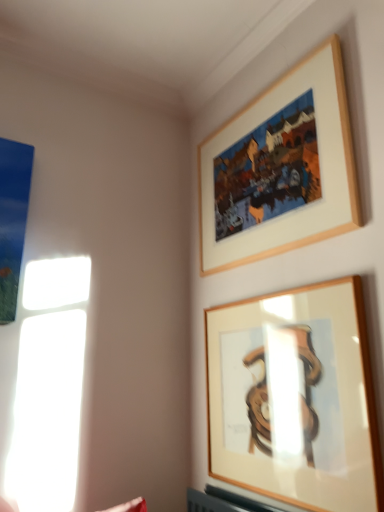
I want to click on wooden frame at upper center, the first picture frame in the top-to-bottom sequence, so click(x=281, y=168).

Describe the element at coordinates (281, 168) in the screenshot. I see `wooden frame at upper center, the first picture frame in the top-to-bottom sequence` at that location.

Measure the distance between wooden frame at upper center, the first picture frame in the top-to-bottom sequence, and camera.

A distance of 1.32 meters exists between wooden frame at upper center, the first picture frame in the top-to-bottom sequence, and camera.

The image size is (384, 512). What do you see at coordinates (295, 398) in the screenshot?
I see `wooden frame at upper center, marked as the 1th picture frame in a bottom-to-top arrangement` at bounding box center [295, 398].

At what (x,y) coordinates should I click in order to perform the action: click on wooden frame at upper center, marked as the 1th picture frame in a bottom-to-top arrangement. Please return your answer as a coordinate pair (x, y). This screenshot has height=512, width=384. Looking at the image, I should click on (295, 398).

Find the location of a particular element. This screenshot has height=512, width=384. wooden frame at upper center, the first picture frame in the top-to-bottom sequence is located at coordinates (281, 168).

Does wooden frame at upper center, positioned as the second picture frame in top-to-bottom order, appear on the right side of wooden frame at upper center, which ranks as the second picture frame in bottom-to-top order?

Yes.

Does wooden frame at upper center, positioned as the second picture frame in top-to-bottom order, come behind wooden frame at upper center, the first picture frame in the top-to-bottom sequence?

No, it is in front of wooden frame at upper center, the first picture frame in the top-to-bottom sequence.

Which point is more forward, (282, 330) or (292, 208)?

The point (282, 330) is more forward.

Based on the photo, from the image's perspective, between wooden frame at upper center, positioned as the second picture frame in top-to-bottom order, and wooden frame at upper center, the first picture frame in the top-to-bottom sequence, which one is located above?

wooden frame at upper center, the first picture frame in the top-to-bottom sequence, is shown above in the image.

From a real-world perspective, is wooden frame at upper center, positioned as the second picture frame in top-to-bottom order, below wooden frame at upper center, which ranks as the second picture frame in bottom-to-top order?

Indeed, from a real-world perspective, wooden frame at upper center, positioned as the second picture frame in top-to-bottom order, is positioned beneath wooden frame at upper center, which ranks as the second picture frame in bottom-to-top order.

Is wooden frame at upper center, positioned as the second picture frame in top-to-bottom order, wider or thinner than wooden frame at upper center, the first picture frame in the top-to-bottom sequence?

Considering their sizes, wooden frame at upper center, positioned as the second picture frame in top-to-bottom order, looks slimmer than wooden frame at upper center, the first picture frame in the top-to-bottom sequence.

In terms of height, does wooden frame at upper center, positioned as the second picture frame in top-to-bottom order, look taller or shorter compared to wooden frame at upper center, which ranks as the second picture frame in bottom-to-top order?

wooden frame at upper center, positioned as the second picture frame in top-to-bottom order, is shorter than wooden frame at upper center, which ranks as the second picture frame in bottom-to-top order.

Who is smaller, wooden frame at upper center, positioned as the second picture frame in top-to-bottom order, or wooden frame at upper center, the first picture frame in the top-to-bottom sequence?

wooden frame at upper center, positioned as the second picture frame in top-to-bottom order, is smaller.

Would you say wooden frame at upper center, positioned as the second picture frame in top-to-bottom order, is inside or outside wooden frame at upper center, the first picture frame in the top-to-bottom sequence?

wooden frame at upper center, positioned as the second picture frame in top-to-bottom order, is not inside wooden frame at upper center, the first picture frame in the top-to-bottom sequence, it's outside.

Is wooden frame at upper center, marked as the 1th picture frame in a bottom-to-top arrangement, in contact with wooden frame at upper center, the first picture frame in the top-to-bottom sequence?

wooden frame at upper center, marked as the 1th picture frame in a bottom-to-top arrangement, and wooden frame at upper center, the first picture frame in the top-to-bottom sequence, are clearly separated.

Is wooden frame at upper center, positioned as the second picture frame in top-to-bottom order, oriented towards wooden frame at upper center, which ranks as the second picture frame in bottom-to-top order?

No, wooden frame at upper center, positioned as the second picture frame in top-to-bottom order, is not facing towards wooden frame at upper center, which ranks as the second picture frame in bottom-to-top order.

How different are the orientations of wooden frame at upper center, marked as the 1th picture frame in a bottom-to-top arrangement, and wooden frame at upper center, which ranks as the second picture frame in bottom-to-top order, in degrees?

The angular difference between wooden frame at upper center, marked as the 1th picture frame in a bottom-to-top arrangement, and wooden frame at upper center, which ranks as the second picture frame in bottom-to-top order, is 0.000767 degrees.

Locate an element on the screen. picture frame below the wooden frame at upper center, the first picture frame in the top-to-bottom sequence (from a real-world perspective) is located at coordinates click(295, 398).

Does wooden frame at upper center, the first picture frame in the top-to-bottom sequence, appear on the left side of wooden frame at upper center, marked as the 1th picture frame in a bottom-to-top arrangement?

Yes.

In the scene shown: Who is more distant, wooden frame at upper center, which ranks as the second picture frame in bottom-to-top order, or wooden frame at upper center, positioned as the second picture frame in top-to-bottom order?

Positioned behind is wooden frame at upper center, which ranks as the second picture frame in bottom-to-top order.

Considering the positions of point (313, 179) and point (335, 351), is point (313, 179) closer or farther from the camera than point (335, 351)?

Clearly, point (313, 179) is more distant from the camera than point (335, 351).

In the scene shown: From the image's perspective, is wooden frame at upper center, the first picture frame in the top-to-bottom sequence, located beneath wooden frame at upper center, positioned as the second picture frame in top-to-bottom order?

Incorrect, from the image's perspective, wooden frame at upper center, the first picture frame in the top-to-bottom sequence, is higher than wooden frame at upper center, positioned as the second picture frame in top-to-bottom order.

From a real-world perspective, is wooden frame at upper center, which ranks as the second picture frame in bottom-to-top order, physically located above or below wooden frame at upper center, marked as the 1th picture frame in a bottom-to-top arrangement?

Clearly, from a real-world perspective, wooden frame at upper center, which ranks as the second picture frame in bottom-to-top order, is above wooden frame at upper center, marked as the 1th picture frame in a bottom-to-top arrangement.

Is wooden frame at upper center, which ranks as the second picture frame in bottom-to-top order, wider or thinner than wooden frame at upper center, positioned as the second picture frame in top-to-bottom order?

Considering their sizes, wooden frame at upper center, which ranks as the second picture frame in bottom-to-top order, looks broader than wooden frame at upper center, positioned as the second picture frame in top-to-bottom order.

Can you confirm if wooden frame at upper center, the first picture frame in the top-to-bottom sequence, is taller than wooden frame at upper center, marked as the 1th picture frame in a bottom-to-top arrangement?

Correct, wooden frame at upper center, the first picture frame in the top-to-bottom sequence, is much taller as wooden frame at upper center, marked as the 1th picture frame in a bottom-to-top arrangement.

Between wooden frame at upper center, which ranks as the second picture frame in bottom-to-top order, and wooden frame at upper center, positioned as the second picture frame in top-to-bottom order, which one has larger size?

wooden frame at upper center, which ranks as the second picture frame in bottom-to-top order, is bigger.

Is wooden frame at upper center, which ranks as the second picture frame in bottom-to-top order, situated inside wooden frame at upper center, positioned as the second picture frame in top-to-bottom order, or outside?

wooden frame at upper center, which ranks as the second picture frame in bottom-to-top order, exists outside the volume of wooden frame at upper center, positioned as the second picture frame in top-to-bottom order.

Is wooden frame at upper center, the first picture frame in the top-to-bottom sequence, not close to wooden frame at upper center, marked as the 1th picture frame in a bottom-to-top arrangement?

That's not correct — wooden frame at upper center, the first picture frame in the top-to-bottom sequence, is a little close to wooden frame at upper center, marked as the 1th picture frame in a bottom-to-top arrangement.

Based on the photo, is wooden frame at upper center, which ranks as the second picture frame in bottom-to-top order, facing towards wooden frame at upper center, positioned as the second picture frame in top-to-bottom order?

No.

Can you tell me how much wooden frame at upper center, the first picture frame in the top-to-bottom sequence, and wooden frame at upper center, positioned as the second picture frame in top-to-bottom order, differ in facing direction?

wooden frame at upper center, the first picture frame in the top-to-bottom sequence, and wooden frame at upper center, positioned as the second picture frame in top-to-bottom order, are facing 0.000767 degrees away from each other.

Could you measure the distance between wooden frame at upper center, which ranks as the second picture frame in bottom-to-top order, and wooden frame at upper center, marked as the 1th picture frame in a bottom-to-top arrangement?

The distance of wooden frame at upper center, which ranks as the second picture frame in bottom-to-top order, from wooden frame at upper center, marked as the 1th picture frame in a bottom-to-top arrangement, is 20.13 inches.

Identify the location of picture frame on the left of the wooden frame at upper center, positioned as the second picture frame in top-to-bottom order. (281, 168).

Where is `picture frame lying below the wooden frame at upper center, the first picture frame in the top-to-bottom sequence (from the image's perspective)`? The image size is (384, 512). picture frame lying below the wooden frame at upper center, the first picture frame in the top-to-bottom sequence (from the image's perspective) is located at coordinates (295, 398).

This screenshot has height=512, width=384. I want to click on picture frame on the right of the wooden frame at upper center, the first picture frame in the top-to-bottom sequence, so click(295, 398).